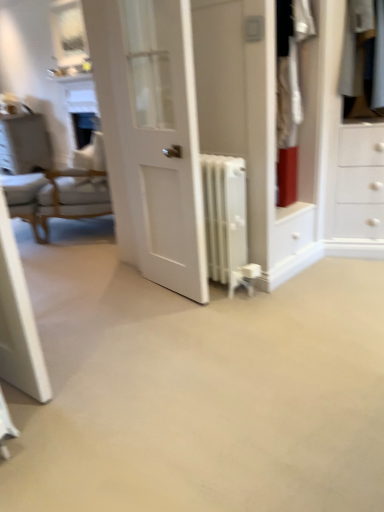
Question: Is white glossy vanity at upper left positioned behind white glossy door at center?

Choices:
 (A) yes
 (B) no

Answer: (A)

Question: Is white glossy door at center inside white glossy vanity at upper left?

Choices:
 (A) no
 (B) yes

Answer: (A)

Question: Considering the relative positions of white glossy vanity at upper left and white glossy door at center in the image provided, is white glossy vanity at upper left to the right of white glossy door at center from the viewer's perspective?

Choices:
 (A) no
 (B) yes

Answer: (A)

Question: From a real-world perspective, is white glossy vanity at upper left positioned over white glossy door at center based on gravity?

Choices:
 (A) no
 (B) yes

Answer: (A)

Question: Would you say white glossy vanity at upper left is a long distance from white glossy door at center?

Choices:
 (A) no
 (B) yes

Answer: (B)

Question: Looking at their shapes, would you say white glossy door at center is wider or thinner than white cotton shirt at upper right?

Choices:
 (A) thin
 (B) wide

Answer: (A)

Question: Looking at the image, does white glossy door at center seem bigger or smaller compared to white cotton shirt at upper right?

Choices:
 (A) small
 (B) big

Answer: (B)

Question: Is white glossy door at center situated inside white cotton shirt at upper right or outside?

Choices:
 (A) outside
 (B) inside

Answer: (A)

Question: From a real-world perspective, relative to white cotton shirt at upper right, is white glossy door at center vertically above or below?

Choices:
 (A) above
 (B) below

Answer: (B)

Question: Is white fabric chair at left bigger or smaller than white glossy door at center?

Choices:
 (A) big
 (B) small

Answer: (A)

Question: Visually, is white fabric chair at left positioned to the left or to the right of white glossy door at center?

Choices:
 (A) right
 (B) left

Answer: (B)

Question: From the image's perspective, is white fabric chair at left located above or below white glossy door at center?

Choices:
 (A) above
 (B) below

Answer: (A)

Question: Looking at their shapes, would you say white fabric chair at left is wider or thinner than white glossy door at center?

Choices:
 (A) thin
 (B) wide

Answer: (B)

Question: From a real-world perspective, relative to white metallic radiator at center, is white glossy door at center vertically above or below?

Choices:
 (A) below
 (B) above

Answer: (B)

Question: Considering the positions of white glossy door at center and white metallic radiator at center in the image, is white glossy door at center bigger or smaller than white metallic radiator at center?

Choices:
 (A) small
 (B) big

Answer: (B)